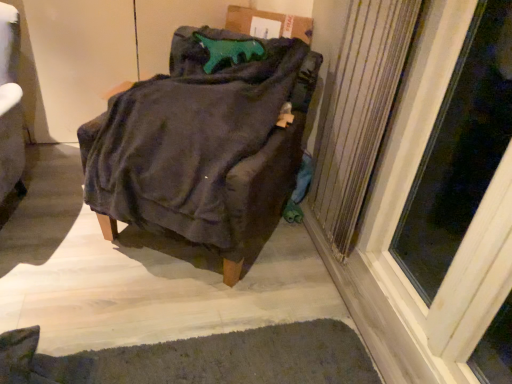
Question: From the image's perspective, is metallic silver radiator at right under dark gray textured mat at lower center?

Choices:
 (A) yes
 (B) no

Answer: (B)

Question: Does metallic silver radiator at right have a lesser height compared to dark gray textured mat at lower center?

Choices:
 (A) no
 (B) yes

Answer: (A)

Question: Can you confirm if metallic silver radiator at right is positioned to the left of dark gray textured mat at lower center?

Choices:
 (A) no
 (B) yes

Answer: (A)

Question: From the image's perspective, would you say metallic silver radiator at right is positioned over dark gray textured mat at lower center?

Choices:
 (A) no
 (B) yes

Answer: (B)

Question: Is metallic silver radiator at right oriented towards dark gray textured mat at lower center?

Choices:
 (A) no
 (B) yes

Answer: (A)

Question: Choose the correct answer: Is dark gray textured mat at lower center inside velvety dark gray chair at center or outside it?

Choices:
 (A) inside
 (B) outside

Answer: (B)

Question: Looking at their shapes, would you say dark gray textured mat at lower center is wider or thinner than velvety dark gray chair at center?

Choices:
 (A) wide
 (B) thin

Answer: (A)

Question: From a real-world perspective, is dark gray textured mat at lower center above or below velvety dark gray chair at center?

Choices:
 (A) below
 (B) above

Answer: (A)

Question: Considering the relative positions of dark gray textured mat at lower center and velvety dark gray chair at center in the image provided, is dark gray textured mat at lower center to the left or to the right of velvety dark gray chair at center?

Choices:
 (A) left
 (B) right

Answer: (B)

Question: Based on their positions, is velvety dark gray chair at center located to the left or right of dark gray textured mat at lower center?

Choices:
 (A) right
 (B) left

Answer: (B)

Question: From a real-world perspective, is velvety dark gray chair at center above or below dark gray textured mat at lower center?

Choices:
 (A) above
 (B) below

Answer: (A)

Question: In terms of height, does velvety dark gray chair at center look taller or shorter compared to dark gray textured mat at lower center?

Choices:
 (A) tall
 (B) short

Answer: (A)

Question: From the image's perspective, relative to dark gray textured mat at lower center, is velvety dark gray chair at center above or below?

Choices:
 (A) above
 (B) below

Answer: (A)

Question: Is velvety dark gray chair at center to the left or to the right of transparent glass screen door at right in the image?

Choices:
 (A) left
 (B) right

Answer: (A)

Question: Is point (182, 193) closer or farther from the camera than point (401, 266)?

Choices:
 (A) farther
 (B) closer

Answer: (B)